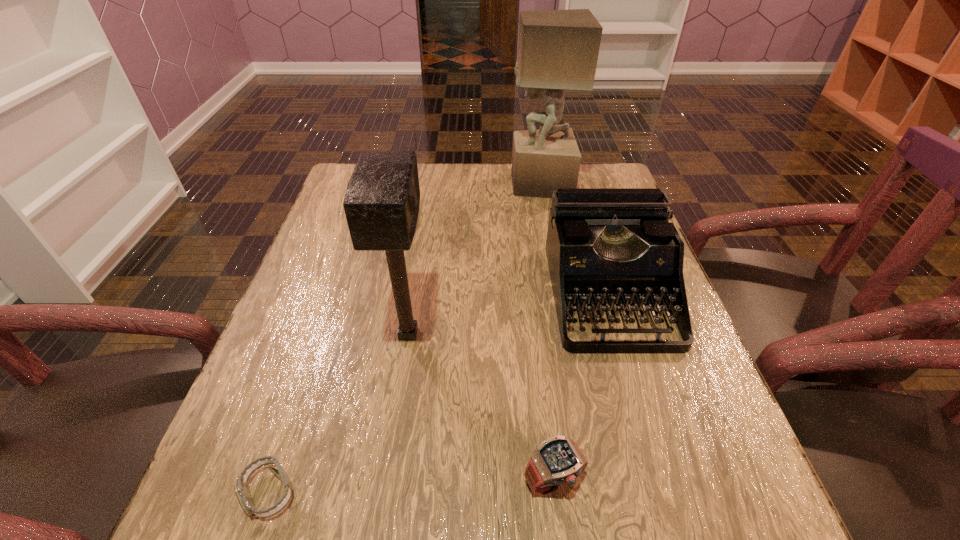
Locate an element on the screen. vacant area between the third tallest object and the shorter watch is located at coordinates (439, 393).

At what (x,y) coordinates should I click in order to perform the action: click on vacant region between the fourth tallest object and the left watch. Please return your answer as a coordinate pair (x, y). The image size is (960, 540). Looking at the image, I should click on (412, 487).

You are a GUI agent. You are given a task and a screenshot of the screen. Output one action in this format:
    pyautogui.click(x=<x>, y=<y>)
    Task: Click on the free space between the right watch and the typewriter
    This screenshot has width=960, height=540.
    Given the screenshot: What is the action you would take?
    pyautogui.click(x=581, y=387)

Locate an element on the screen. The width and height of the screenshot is (960, 540). free space between the typewriter and the mallet is located at coordinates (508, 314).

Image resolution: width=960 pixels, height=540 pixels. Find the location of `the closest object relative to the leftmost object`. the closest object relative to the leftmost object is located at coordinates (381, 204).

Locate an element on the screen. object that is the second closest to the sculpture is located at coordinates (381, 204).

The image size is (960, 540). What are the coordinates of `vacant space that satisfies the following two spatial constraints: 1. on the front-facing side of the farthest object; 2. on the front side of the taller watch` in the screenshot? It's located at (595, 480).

The height and width of the screenshot is (540, 960). Find the location of `vacant area that satisfies the following two spatial constraints: 1. on the front-facing side of the farthest object; 2. on the front side of the right watch`. vacant area that satisfies the following two spatial constraints: 1. on the front-facing side of the farthest object; 2. on the front side of the right watch is located at coordinates (595, 480).